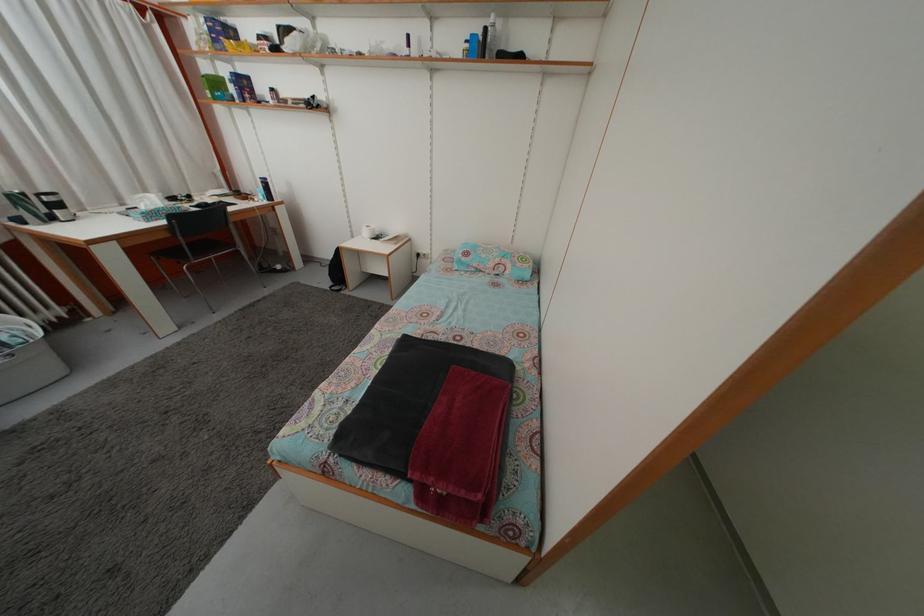
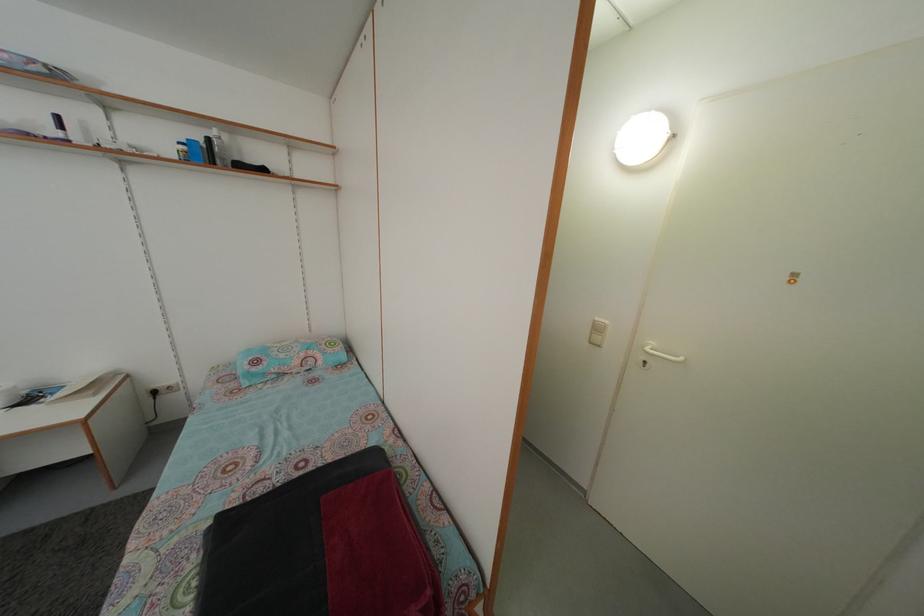
Where in the second image is the point corresponding to point 507,55 from the first image?

(242, 166)